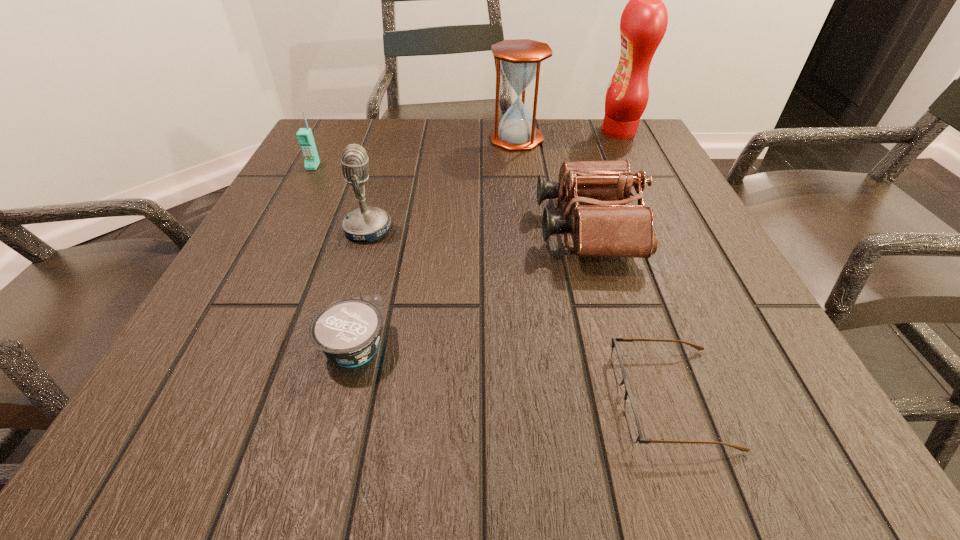
Locate an element on the screen. vacant area that lies between the cellular telephone and the spectacles is located at coordinates (492, 282).

Image resolution: width=960 pixels, height=540 pixels. In order to click on free space between the leftmost object and the microphone in this screenshot , I will do `click(341, 198)`.

Find the location of a particular element. The width and height of the screenshot is (960, 540). empty space between the yogurt and the second tallest object is located at coordinates (436, 243).

Where is `free space between the hourglass and the cellular telephone`? free space between the hourglass and the cellular telephone is located at coordinates (415, 153).

The height and width of the screenshot is (540, 960). In order to click on vacant space that's between the binoculars and the shortest object in this screenshot , I will do `click(630, 313)`.

The image size is (960, 540). Identify the location of empty location between the shortest object and the cellular telephone. [x=492, y=282].

Locate an element on the screen. free spot between the spectacles and the yogurt is located at coordinates (513, 373).

Locate an element on the screen. The width and height of the screenshot is (960, 540). free space between the microphone and the binoculars is located at coordinates (478, 228).

Locate an element on the screen. This screenshot has height=540, width=960. empty space between the microphone and the hourglass is located at coordinates (442, 184).

Select which object appears as the sixth closest to the yogurt. Please provide its 2D coordinates. Your answer should be formatted as a tuple, i.e. [(x, y)], where the tuple contains the x and y coordinates of a point satisfying the conditions above.

[(643, 24)]